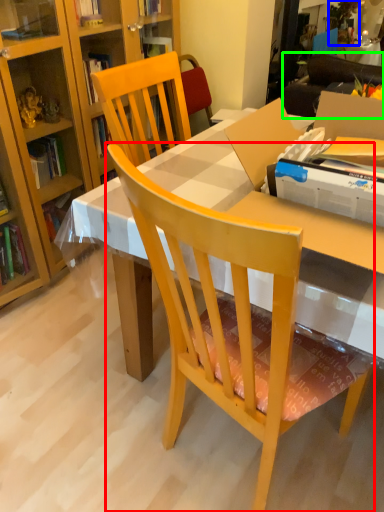
Question: Which object is positioned closest to chair (highlighted by a red box)? Select from houseplant (highlighted by a blue box) and studio couch (highlighted by a green box).

Choices:
 (A) houseplant
 (B) studio couch

Answer: (B)